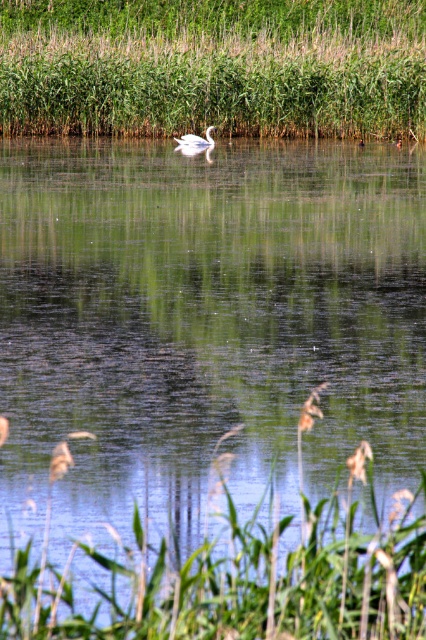
Find the location of `green grass at upper center`. green grass at upper center is located at coordinates (213, 67).

Does green grass at upper center appear over green leafy grass at lower center?

Indeed, green grass at upper center is positioned over green leafy grass at lower center.

The image size is (426, 640). Find the location of `green grass at upper center`. green grass at upper center is located at coordinates (213, 67).

Does green grass at upper center have a lesser width compared to white glossy swan at center?

No.

Does point (120, 12) come farther from viewer compared to point (199, 138)?

Yes, it is.

Which is in front, point (317, 81) or point (199, 145)?

Positioned in front is point (199, 145).

You are a GUI agent. You are given a task and a screenshot of the screen. Output one action in this format:
    pyautogui.click(x=<x>, y=<y>)
    Task: Click on the green grass at upper center
    
    Given the screenshot: What is the action you would take?
    pyautogui.click(x=213, y=67)

Between point (412, 516) and point (198, 141), which one is positioned in front?

Point (412, 516) is in front.

Between green leafy grass at lower center and white glossy swan at center, which one appears on the left side from the viewer's perspective?

From the viewer's perspective, white glossy swan at center appears more on the left side.

Where is `green leafy grass at lower center`? This screenshot has width=426, height=640. green leafy grass at lower center is located at coordinates (241, 577).

At what (x,y) coordinates should I click in order to perform the action: click on green leafy grass at lower center. Please return your answer as a coordinate pair (x, y). Looking at the image, I should click on (241, 577).